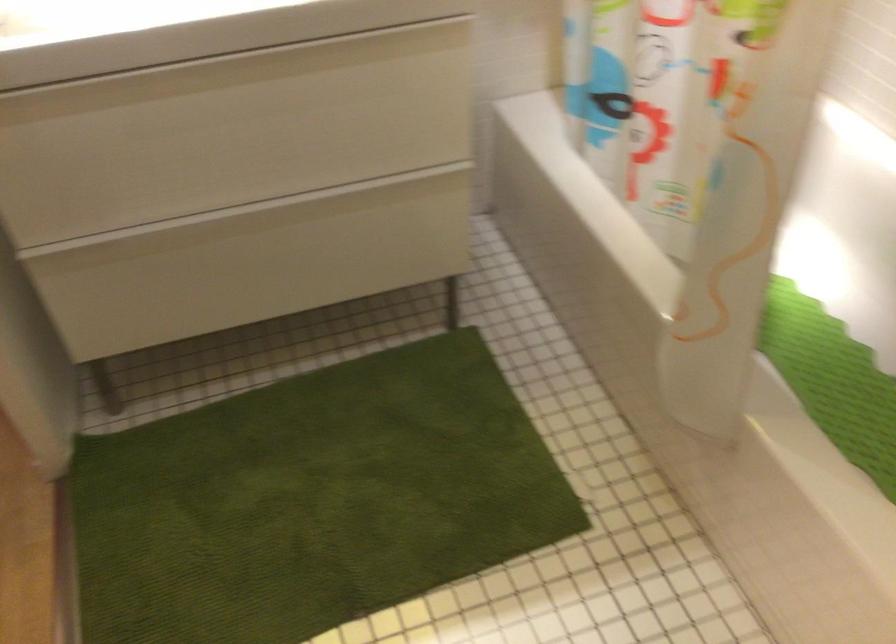
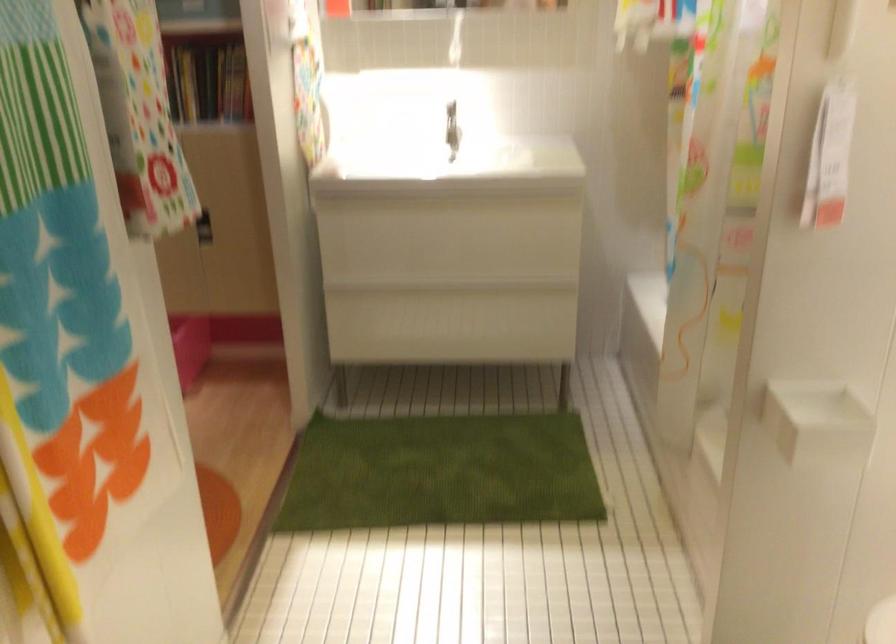
The point at (x=263, y=211) is marked in the first image. Where is the corresponding point in the second image?

(453, 288)